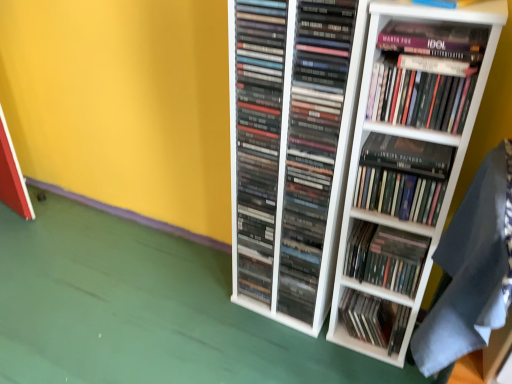
The width and height of the screenshot is (512, 384). I want to click on vacant area in front of matte black cds at center, which is the third book from top to bottom, so click(x=259, y=333).